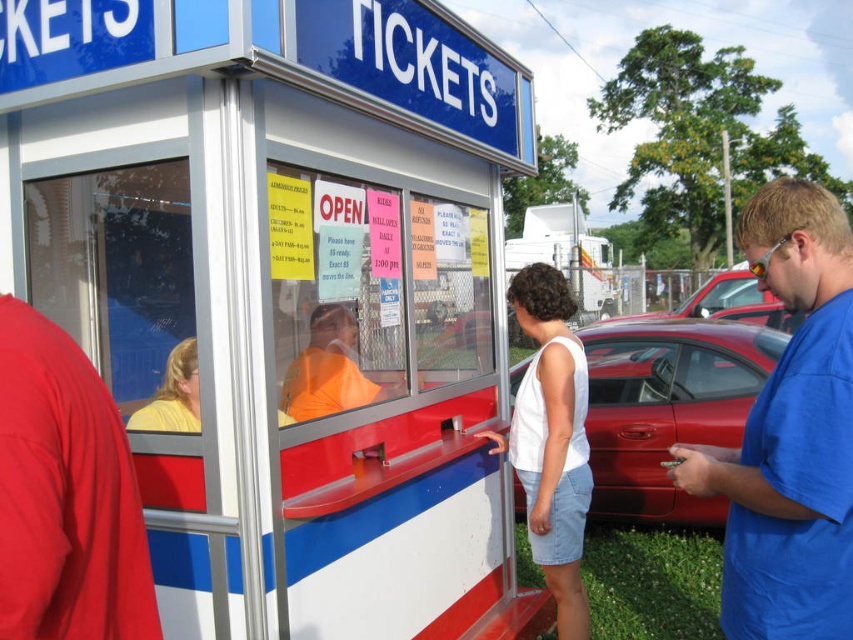
In the scene shown: Is the position of blue cotton shirt at right more distant than that of white cotton tank top at center?

No, blue cotton shirt at right is closer to the viewer.

Between blue cotton shirt at right and white cotton tank top at center, which one has less height?

blue cotton shirt at right

Who is more distant from viewer, (805, 531) or (540, 317)?

The point (540, 317) is more distant.

Locate an element on the screen. The width and height of the screenshot is (853, 640). blue cotton shirt at right is located at coordinates pyautogui.click(x=790, y=433).

In the scene shown: Measure the distance between point (x=795, y=579) and camera.

They are 1.64 meters apart.

Which is behind, point (791, 458) or point (726, 426)?

Positioned behind is point (726, 426).

At what (x,y) coordinates should I click in order to perform the action: click on blue cotton shirt at right. Please return your answer as a coordinate pair (x, y). The width and height of the screenshot is (853, 640). Looking at the image, I should click on (790, 433).

Locate an element on the screen. Image resolution: width=853 pixels, height=640 pixels. blue cotton shirt at right is located at coordinates (790, 433).

Is metallic red booth at center in front of shiny red car at center?

Yes, it is in front of shiny red car at center.

Is metallic red booth at center wider than shiny red car at center?

Indeed, metallic red booth at center has a greater width compared to shiny red car at center.

Identify the location of metallic red booth at center. This screenshot has height=640, width=853. (281, 291).

At what (x,y) coordinates should I click in order to perform the action: click on metallic red booth at center. Please return your answer as a coordinate pair (x, y). The height and width of the screenshot is (640, 853). Looking at the image, I should click on (281, 291).